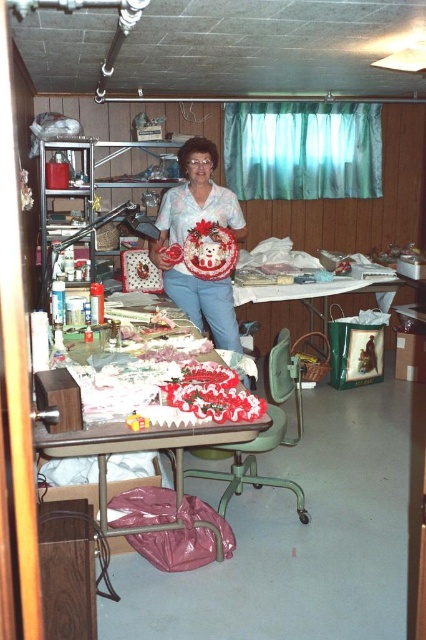
You are organizing a craft fair and need to set up a display. You have a matte white fabric at center and a wooden table at center. Where should you place the fabric relative to the table to match the scene?

The matte white fabric at center should be placed to the right of the wooden table at center as shown in the scene.

You are standing in the craft room and want to place a new decoration between the two points labeled point (x=189, y=180) and point (x=80, y=432). Which point is closer to you so you can start placing the decoration there?

Point (x=80, y=432) is closer to you than point (x=189, y=180), so you should start placing the decoration near point (x=80, y=432).

You are an interior designer assessing the layout of the craft room. You notice a point at coordinates (186, 236) in the room. What object is located at that point?

The point at coordinates (186, 236) corresponds to the matte white fabric at center.